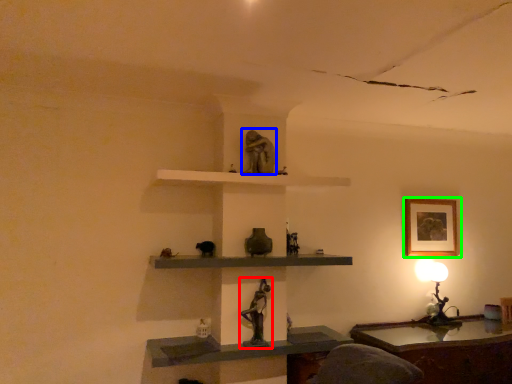
Question: Based on their relative distances, which object is nearer to sculpture (highlighted by a red box)? Choose from sculpture (highlighted by a blue box) and picture frame (highlighted by a green box).

Choices:
 (A) sculpture
 (B) picture frame

Answer: (A)